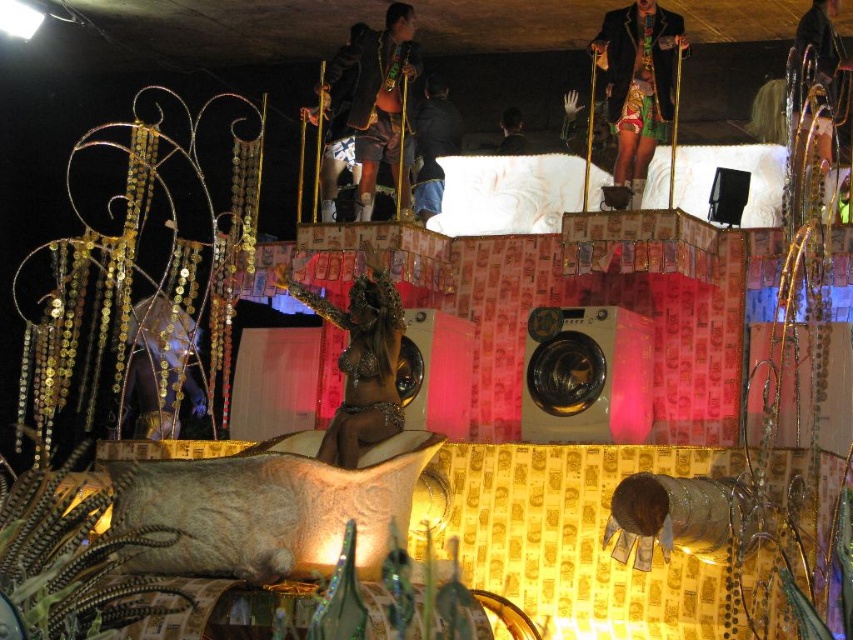
Question: Among these points, which one is farthest from the camera?

Choices:
 (A) (416, 141)
 (B) (286, 280)
 (C) (514, 154)

Answer: (A)

Question: Observing the image, what is the correct spatial positioning of shiny gold statue at center in reference to dark blue jeans at center?

Choices:
 (A) below
 (B) above

Answer: (A)

Question: In this image, where is shiny gold statue at center located relative to dark blue jeans at center?

Choices:
 (A) below
 (B) above

Answer: (A)

Question: Does shiny metallic jacket at upper center appear on the right side of smooth skin figure at center?

Choices:
 (A) no
 (B) yes

Answer: (B)

Question: Which is nearer to the dark blue jeans at center?

Choices:
 (A) shiny metallic jacket at upper center
 (B) shiny gold statue at center

Answer: (A)

Question: Which object is farther from the camera taking this photo?

Choices:
 (A) shiny metallic jacket at upper center
 (B) dark blue jeans at center
 (C) smooth skin figure at center
 (D) shiny gold statue at center

Answer: (C)